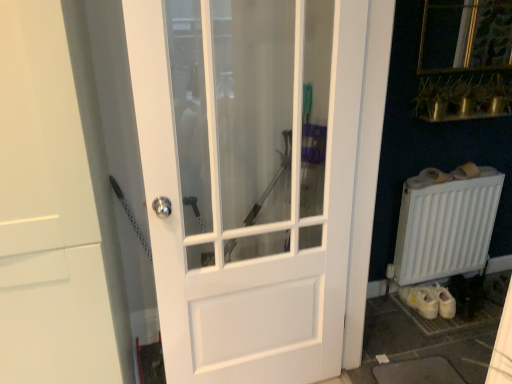
What do you see at coordinates (56, 206) in the screenshot? The width and height of the screenshot is (512, 384). I see `white glossy door at center, the first door when ordered from left to right` at bounding box center [56, 206].

Describe the element at coordinates (243, 198) in the screenshot. The height and width of the screenshot is (384, 512). I see `white glossy door at center, which appears as the first door when viewed from the right` at that location.

In the scene shown: What is the approximate width of white glossy door at center, which appears as the first door when viewed from the right?

white glossy door at center, which appears as the first door when viewed from the right, is 13.41 centimeters in width.

The width and height of the screenshot is (512, 384). I want to click on white glossy door at center, which is the 2th door in right-to-left order, so click(x=56, y=206).

Considering the positions of points (206, 159) and (68, 7), is point (206, 159) farther from camera compared to point (68, 7)?

Yes, it is.

Does white glossy door at center, arranged as the 2th door when viewed from the left, come in front of white glossy door at center, the first door when ordered from left to right?

No.

Is white glossy door at center, arranged as the 2th door when viewed from the left, next to white glossy door at center, which is the 2th door in right-to-left order?

No, white glossy door at center, arranged as the 2th door when viewed from the left, is not in contact with white glossy door at center, which is the 2th door in right-to-left order.

Is white glossy door at center, arranged as the 2th door when viewed from the left, located outside white glossy door at center, which is the 2th door in right-to-left order?

That's correct, white glossy door at center, arranged as the 2th door when viewed from the left, is outside of white glossy door at center, which is the 2th door in right-to-left order.

Considering the sizes of objects white glossy door at center, which appears as the first door when viewed from the right, and white matte radiator at lower right in the image provided, who is smaller, white glossy door at center, which appears as the first door when viewed from the right, or white matte radiator at lower right?

With smaller size is white matte radiator at lower right.

Which is more to the left, white glossy door at center, arranged as the 2th door when viewed from the left, or white matte radiator at lower right?

From the viewer's perspective, white glossy door at center, arranged as the 2th door when viewed from the left, appears more on the left side.

Does point (290, 272) come behind point (412, 193)?

No, it is not.

Does white glossy door at center, the first door when ordered from left to right, have a greater height compared to white matte radiator at lower right?

Correct, white glossy door at center, the first door when ordered from left to right, is much taller as white matte radiator at lower right.

Between white glossy door at center, which is the 2th door in right-to-left order, and white matte radiator at lower right, which one appears on the right side from the viewer's perspective?

white matte radiator at lower right.

Between point (20, 272) and point (390, 276), which one is positioned behind?

The point (390, 276) is farther.

Which object is positioned more to the right, white matte radiator at lower right or white glossy door at center, which appears as the first door when viewed from the right?

white matte radiator at lower right.

Can you confirm if white matte radiator at lower right is smaller than white glossy door at center, arranged as the 2th door when viewed from the left?

Yes.

Where is `radiator on the right of the white glossy door at center, which appears as the first door when viewed from the right`? Image resolution: width=512 pixels, height=384 pixels. radiator on the right of the white glossy door at center, which appears as the first door when viewed from the right is located at coordinates (445, 223).

Between point (398, 282) and point (190, 328), which one is positioned behind?

The point (398, 282) is farther from the camera.

Where is `radiator behind the white glossy door at center, which is the 2th door in right-to-left order`? radiator behind the white glossy door at center, which is the 2th door in right-to-left order is located at coordinates [445, 223].

Is white matte radiator at lower right positioned far away from white glossy door at center, which is the 2th door in right-to-left order?

Absolutely, white matte radiator at lower right is distant from white glossy door at center, which is the 2th door in right-to-left order.

Is white matte radiator at lower right positioned beyond the bounds of white glossy door at center, the first door when ordered from left to right?

Absolutely, white matte radiator at lower right is external to white glossy door at center, the first door when ordered from left to right.

Looking at this image, is the depth of white matte radiator at lower right greater than that of white glossy door at center, which is the 2th door in right-to-left order?

Yes, the depth of white matte radiator at lower right is greater than that of white glossy door at center, which is the 2th door in right-to-left order.

Consider the image. Can you see white glossy door at center, the first door when ordered from left to right, touching white glossy door at center, which appears as the first door when viewed from the right?

white glossy door at center, the first door when ordered from left to right, and white glossy door at center, which appears as the first door when viewed from the right, are not in contact.

From the image's perspective, who appears lower, white glossy door at center, the first door when ordered from left to right, or white glossy door at center, which appears as the first door when viewed from the right?

white glossy door at center, the first door when ordered from left to right, is shown below in the image.

Considering the positions of objects white glossy door at center, which is the 2th door in right-to-left order, and white glossy door at center, arranged as the 2th door when viewed from the left, in the image provided, who is more to the right, white glossy door at center, which is the 2th door in right-to-left order, or white glossy door at center, arranged as the 2th door when viewed from the left,?

white glossy door at center, arranged as the 2th door when viewed from the left, is more to the right.

Which is farther, (0, 125) or (229, 111)?

The point (229, 111) is more distant.

Identify the location of door on the right of the white glossy door at center, which is the 2th door in right-to-left order. (243, 198).

Where is `radiator below the white glossy door at center, arranged as the 2th door when viewed from the left (from a real-world perspective)`? The image size is (512, 384). radiator below the white glossy door at center, arranged as the 2th door when viewed from the left (from a real-world perspective) is located at coordinates (445, 223).

When comparing their distances from white glossy door at center, the first door when ordered from left to right, does white glossy door at center, which appears as the first door when viewed from the right, or white matte radiator at lower right seem closer?

white glossy door at center, which appears as the first door when viewed from the right, lies closer to white glossy door at center, the first door when ordered from left to right, than the other object.

From the image, which object appears to be nearer to white glossy door at center, which is the 2th door in right-to-left order, white matte radiator at lower right or white glossy door at center, arranged as the 2th door when viewed from the left?

Based on the image, white glossy door at center, arranged as the 2th door when viewed from the left, appears to be nearer to white glossy door at center, which is the 2th door in right-to-left order.

Based on their spatial positions, is white glossy door at center, the first door when ordered from left to right, or white glossy door at center, arranged as the 2th door when viewed from the left, further from white matte radiator at lower right?

white glossy door at center, the first door when ordered from left to right.

Which object lies further to the anchor point white glossy door at center, which appears as the first door when viewed from the right, white glossy door at center, which is the 2th door in right-to-left order, or white matte radiator at lower right?

white matte radiator at lower right is further to white glossy door at center, which appears as the first door when viewed from the right.

Based on their spatial positions, is white glossy door at center, which appears as the first door when viewed from the right, or white glossy door at center, the first door when ordered from left to right, closer to white matte radiator at lower right?

white glossy door at center, which appears as the first door when viewed from the right, is closer to white matte radiator at lower right.

From the picture: From the image, which object appears to be nearer to white glossy door at center, arranged as the 2th door when viewed from the left, white matte radiator at lower right or white glossy door at center, which is the 2th door in right-to-left order?

Among the two, white glossy door at center, which is the 2th door in right-to-left order, is located nearer to white glossy door at center, arranged as the 2th door when viewed from the left.

I want to click on door located between white glossy door at center, which is the 2th door in right-to-left order, and white matte radiator at lower right in the left-right direction, so click(x=243, y=198).